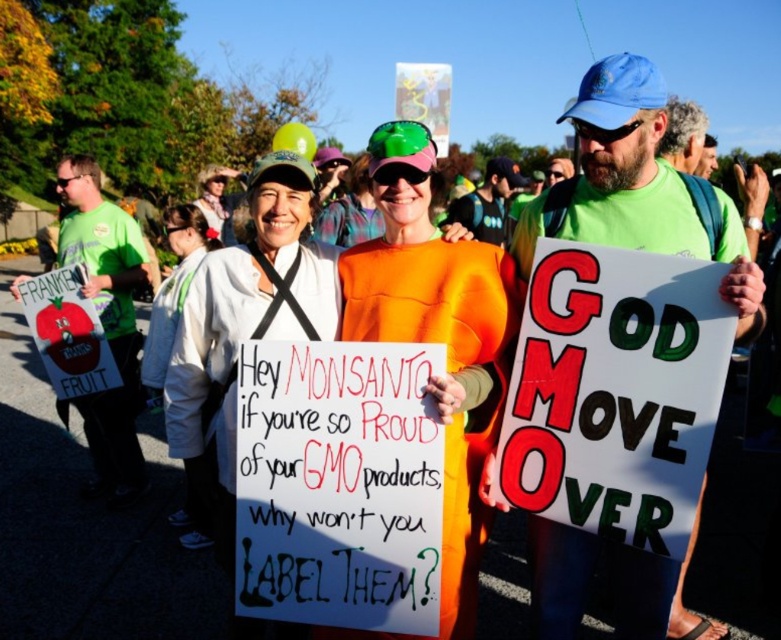
Consider the image. You are a photographer trying to capture a clear shot of both the white cardboard sign at center and the white fleece jacket at center. Based on their positions, which object should you focus on first to ensure both are in focus?

The white cardboard sign at center is in front of the white fleece jacket at center, so you should focus on the white cardboard sign at center first to ensure both are in focus.

You are a photographer at the protest scene. You want to take a photo that includes both the white cardboard sign at center and the orange fabric dress at center. Which object should you focus on first to ensure both are in frame?

You should focus on the orange fabric dress at center first since it is larger than the white cardboard sign at center, ensuring it fits within the frame before adjusting for the smaller sign.